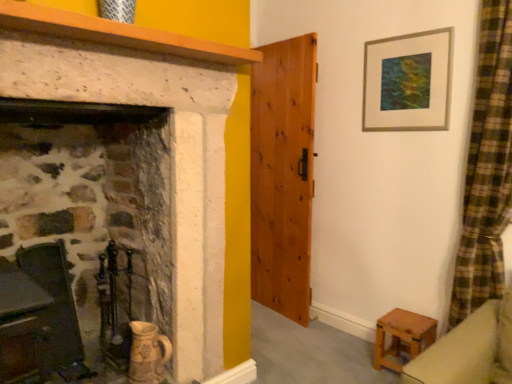
Locate an element on the screen. The image size is (512, 384). free space in front of natural wood door at center is located at coordinates (293, 337).